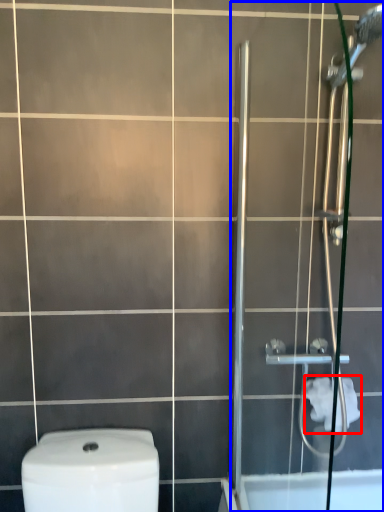
Question: Among these objects, which one is farthest to the camera, toilet paper (highlighted by a red box) or screen door (highlighted by a blue box)?

Choices:
 (A) toilet paper
 (B) screen door

Answer: (A)